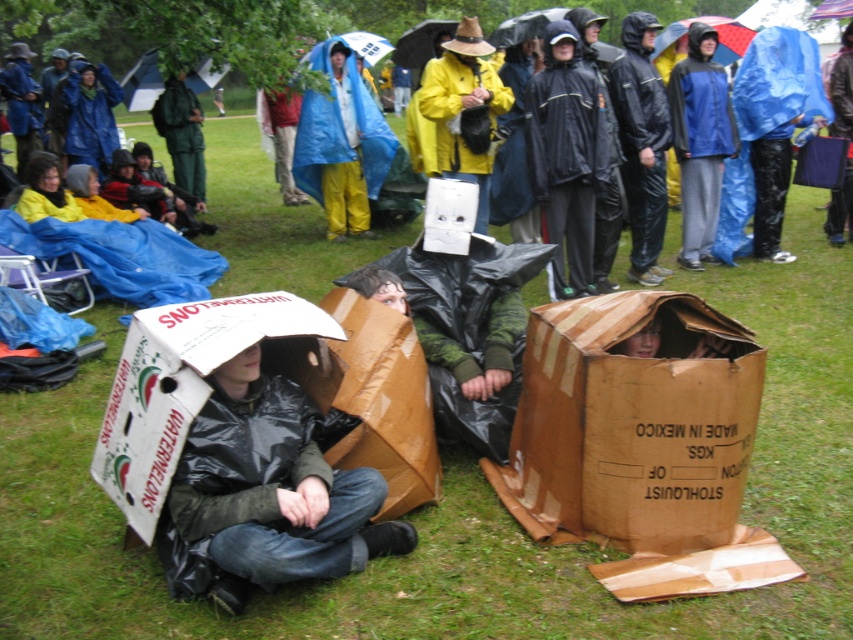
You are a photographer trying to capture a group photo of the people in the scene. You want to ensure that both the brown cardboard box at center and the blue tarpaulin at center are visible in the frame. Based on their positions, which object should you place closer to the left side of the camera frame to include both in the shot?

Since the brown cardboard box at center is to the right of the blue tarpaulin at center, you should position the blue tarpaulin at center closer to the left side of the camera frame to include both objects in the shot.

You are a photographer trying to capture a closeup of the blue matte raincoat at upper right. Based on its position, where should you aim your camera?

The blue matte raincoat at upper right is located at point 0.222 on the x axis and 0.822 on the y axis, so aim your camera towards that coordinate.

You are a photographer trying to capture a candid shot of the people inside the brown cardboard box at center and under the blue tarpaulin at center. Since you want to ensure both subjects are fully visible in the frame, which object should you position closer to the camera to avoid blocking the view?

The brown cardboard box at center is shorter than the blue tarpaulin at center, so positioning the brown cardboard box at center closer to the camera would allow both subjects to be fully visible without obstruction from the taller blue tarpaulin at center.